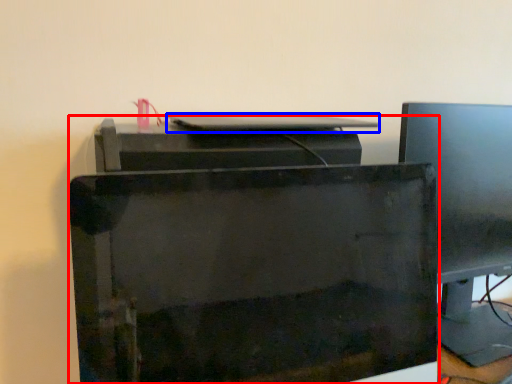
Question: Which object is further to the camera taking this photo, printer (highlighted by a red box) or desktop (highlighted by a blue box)?

Choices:
 (A) printer
 (B) desktop

Answer: (B)